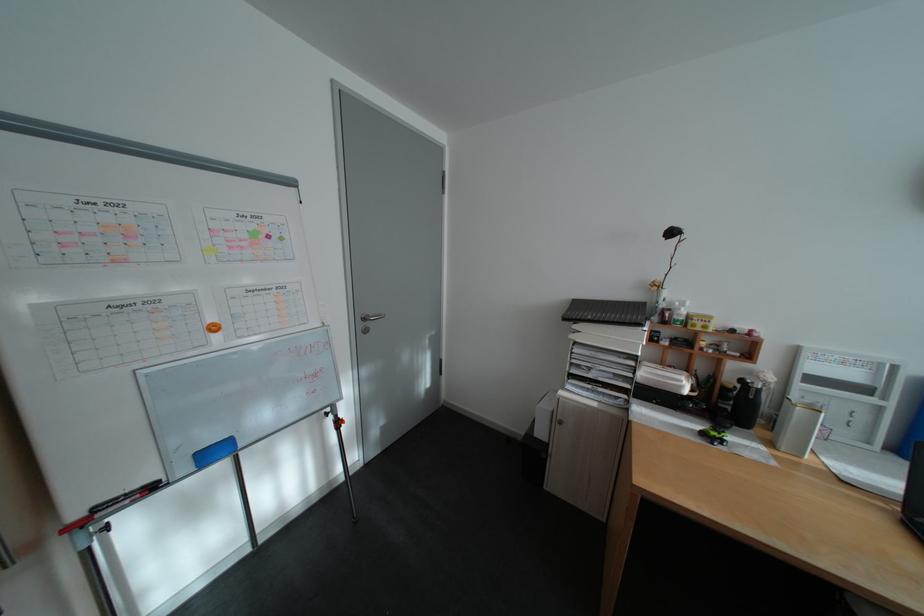
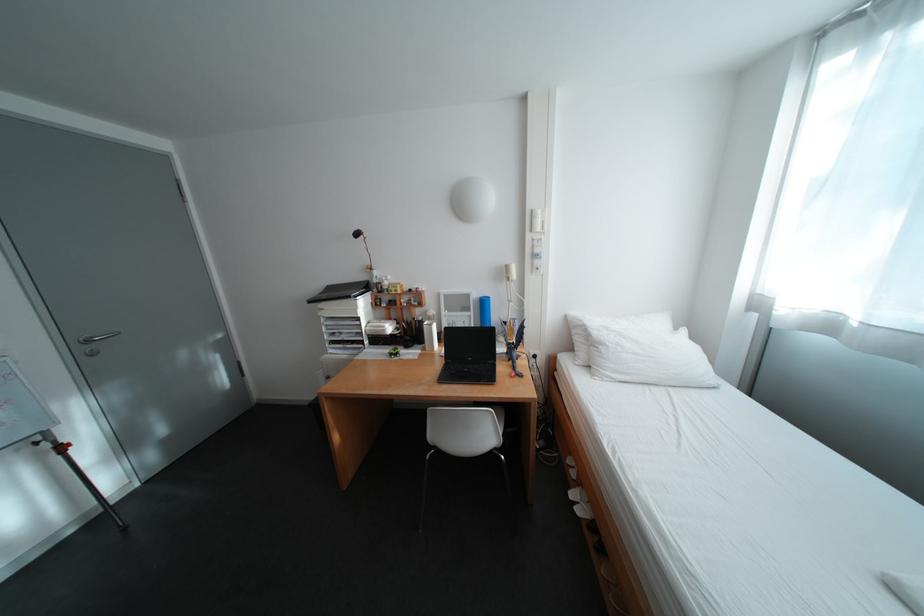
In a continuous first-person perspective shot, in which direction is the camera moving?

The cameraman moved toward right, backward.